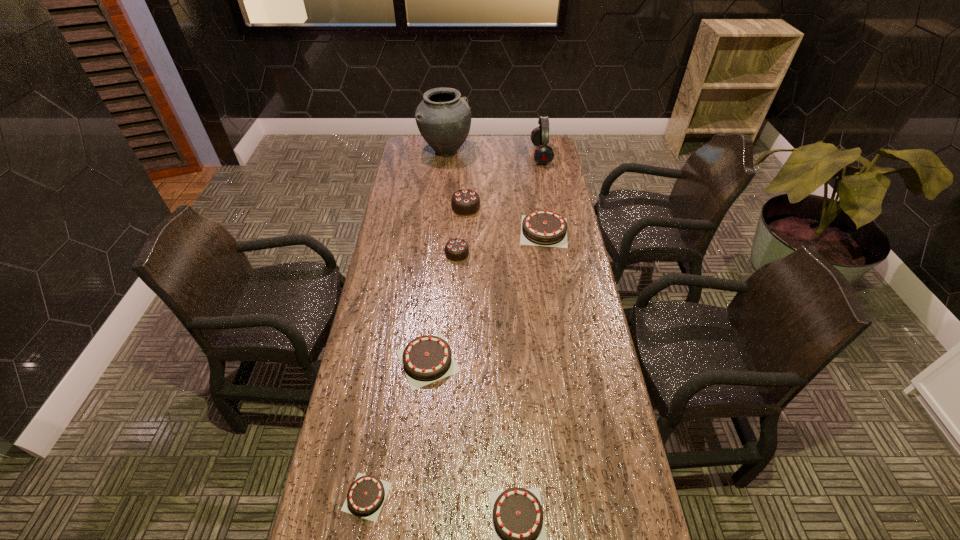
Identify which brown chocolate cake is the fourth closest to the nearer chocolate chocolate cake. Please provide its 2D coordinates. Your answer should be formatted as a tuple, i.e. [(x, y)], where the tuple contains the x and y coordinates of a point satisfying the conditions above.

[(519, 537)]

The height and width of the screenshot is (540, 960). What are the coordinates of `vacant region that satisfies the following two spatial constraints: 1. on the back side of the farther chocolate chocolate cake; 2. on the left side of the fourth farthest chocolate cake` in the screenshot? It's located at (443, 207).